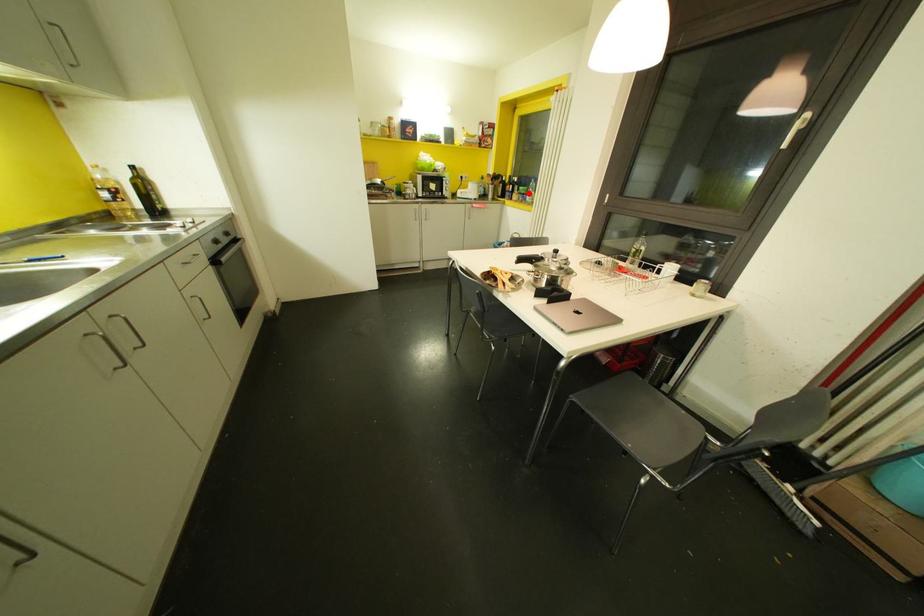
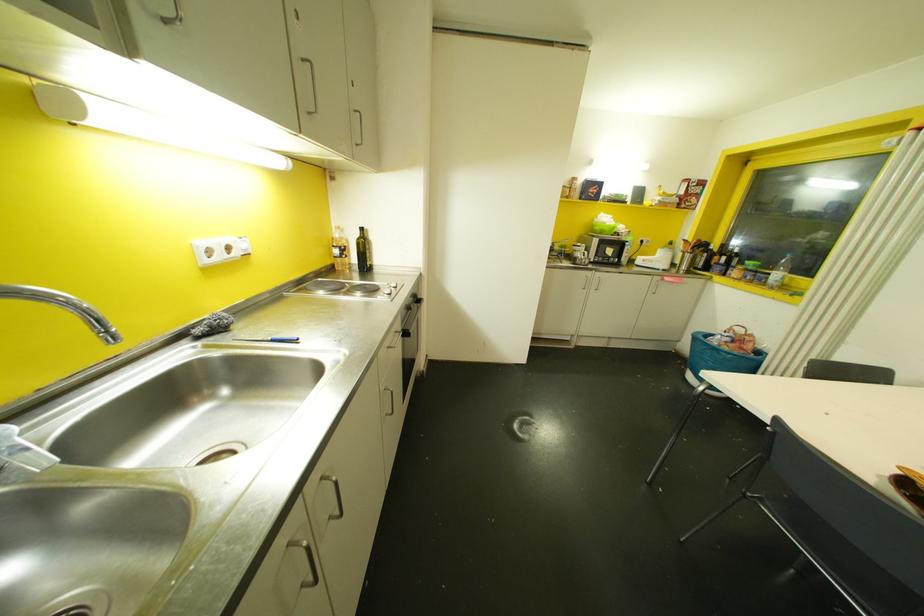
Locate, in the second image, the point that corresponds to the highlighted location in the first image.

(776, 274)